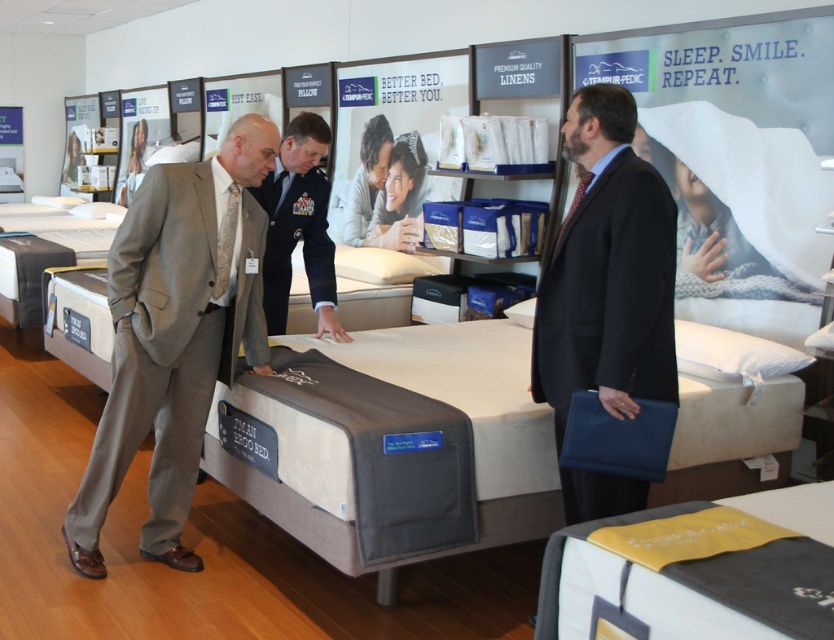
Between beige fabric mattress at center and dark gray suit at center, which one is positioned higher?

Positioned higher is dark gray suit at center.

Is beige fabric mattress at center wider than dark gray suit at center?

Yes.

Find the location of a particular element. The width and height of the screenshot is (834, 640). beige fabric mattress at center is located at coordinates (438, 397).

Between point (124, 237) and point (26, 275), which one is positioned in front?

Point (124, 237)

Where is `gray wool suit at left`? This screenshot has height=640, width=834. gray wool suit at left is located at coordinates (176, 333).

Between point (101, 467) and point (1, 308), which one is positioned in front?

Point (101, 467)

Image resolution: width=834 pixels, height=640 pixels. What are the coordinates of `gray wool suit at left` in the screenshot? It's located at (176, 333).

Who is shorter, beige fabric mattress at center or gray wool suit at left?

beige fabric mattress at center

Is beige fabric mattress at center behind gray wool suit at left?

No, beige fabric mattress at center is closer to the viewer.

The height and width of the screenshot is (640, 834). What are the coordinates of `beige fabric mattress at center` in the screenshot? It's located at (438, 397).